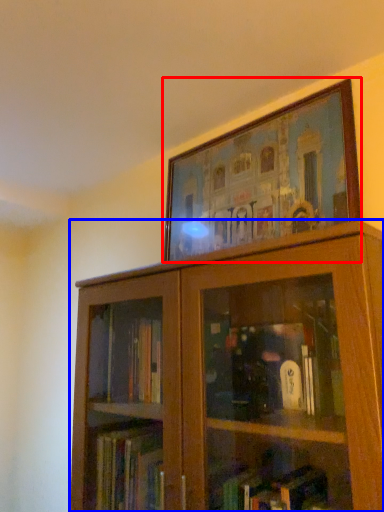
Question: Which object is further to the camera taking this photo, picture frame (highlighted by a red box) or bookcase (highlighted by a blue box)?

Choices:
 (A) picture frame
 (B) bookcase

Answer: (A)